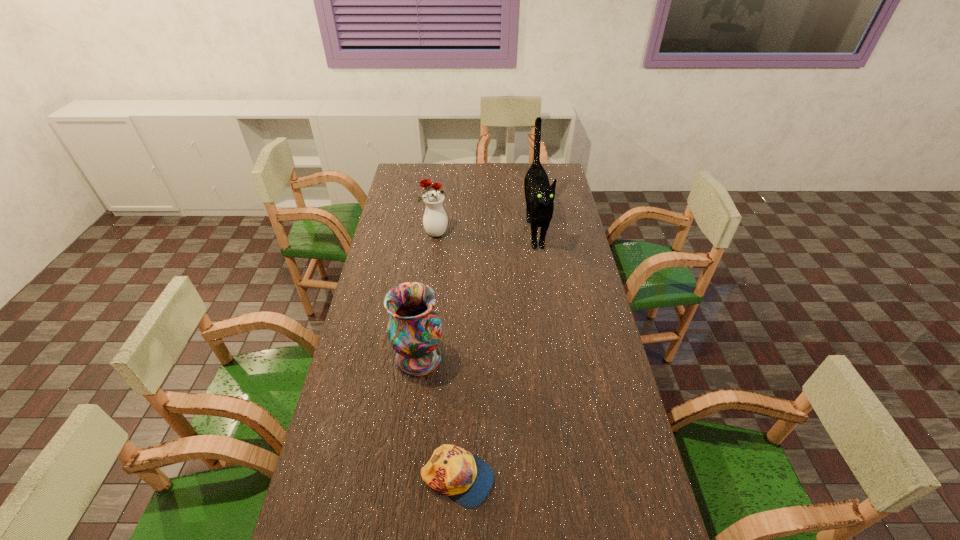
Where is `empty space that is in between the cat and the shortest object`? Image resolution: width=960 pixels, height=540 pixels. empty space that is in between the cat and the shortest object is located at coordinates pos(496,354).

Locate an element on the screen. This screenshot has height=540, width=960. vacant area between the rightmost object and the shortest object is located at coordinates (496, 354).

Locate an element on the screen. Image resolution: width=960 pixels, height=540 pixels. empty location between the third farthest object and the cat is located at coordinates (477, 293).

Find the location of `object that is the second closest to the third farthest object`. object that is the second closest to the third farthest object is located at coordinates pyautogui.click(x=539, y=194).

Select which object is the closest to the cap. Please provide its 2D coordinates. Your answer should be formatted as a tuple, i.e. [(x, y)], where the tuple contains the x and y coordinates of a point satisfying the conditions above.

[(414, 330)]

Find the location of a particular element. The image size is (960, 540). free point that satisfies the following two spatial constraints: 1. on the face of the tallest object; 2. on the bill of the nearest object is located at coordinates (572, 479).

Where is `vacant region that satisfies the following two spatial constraints: 1. on the face of the cat; 2. on the bill of the shortest object`? Image resolution: width=960 pixels, height=540 pixels. vacant region that satisfies the following two spatial constraints: 1. on the face of the cat; 2. on the bill of the shortest object is located at coordinates (572, 479).